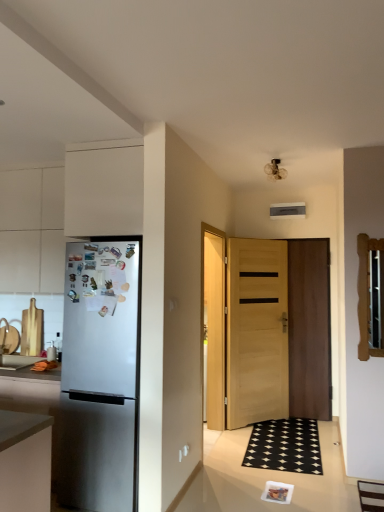
Locate an element on the screen. The width and height of the screenshot is (384, 512). free point below light brown wooden door at center, positioned as the 2th door in right-to-left order (from a real-world perspective) is located at coordinates [x=254, y=425].